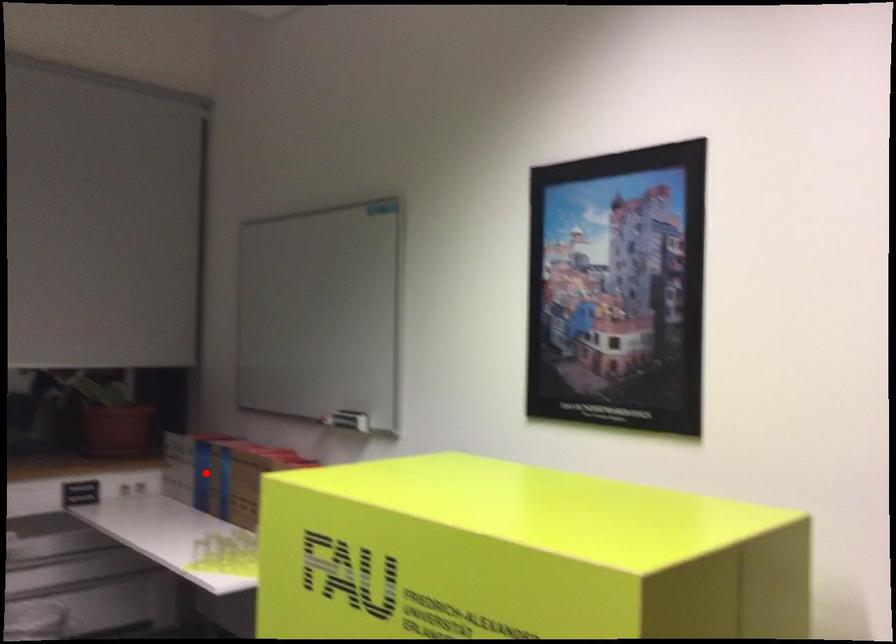
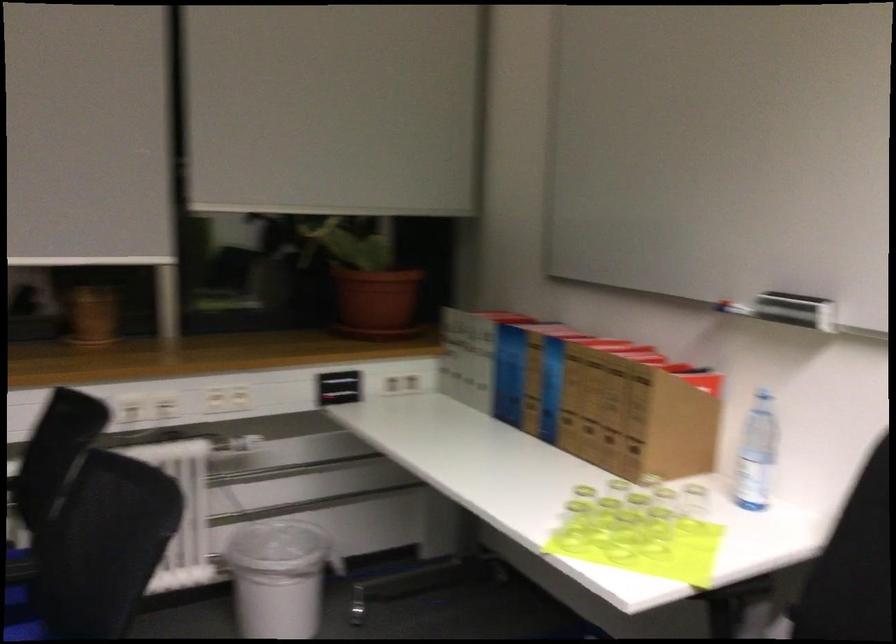
Question: I am providing you with two images of the same scene from different viewpoints. In image1, a red point is highlighted. Considering the same 3D point in image2, which of the following is correct?

Choices:
 (A) It is closer
 (B) It is farther

Answer: (A)